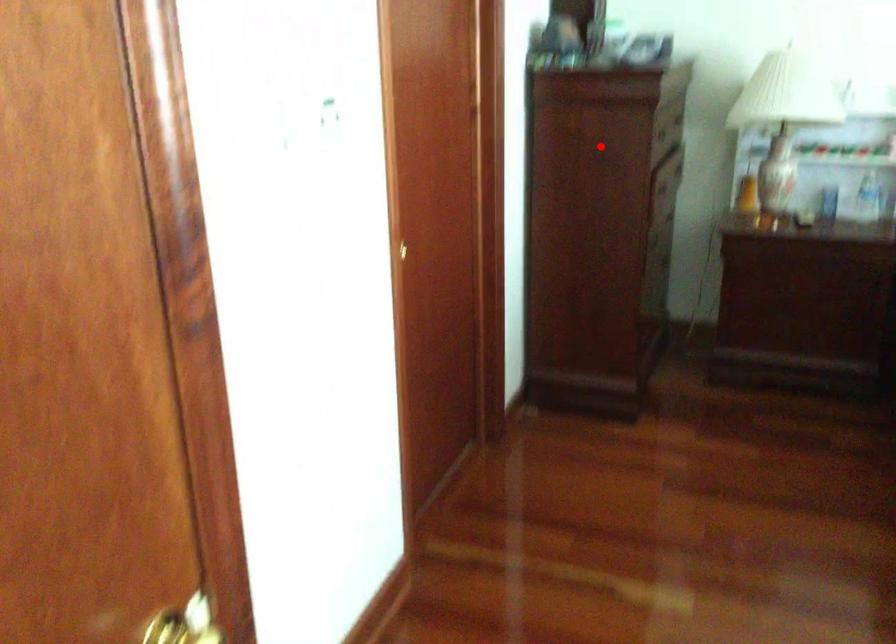
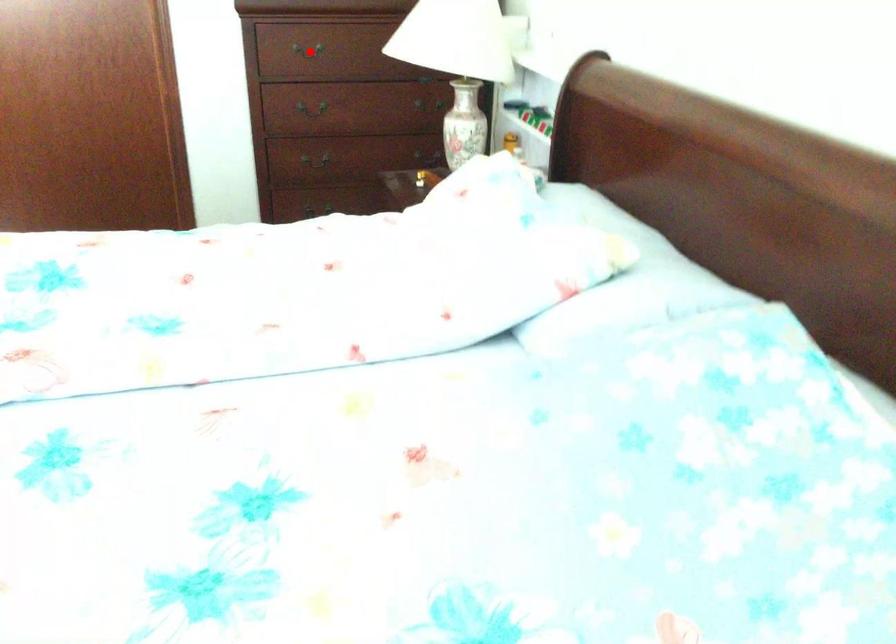
I am providing you with two images of the same scene from different viewpoints. A red point is marked on the first image and another point is marked on the second image. Does the point marked in image1 correspond to the same location as the one in image2?

Yes